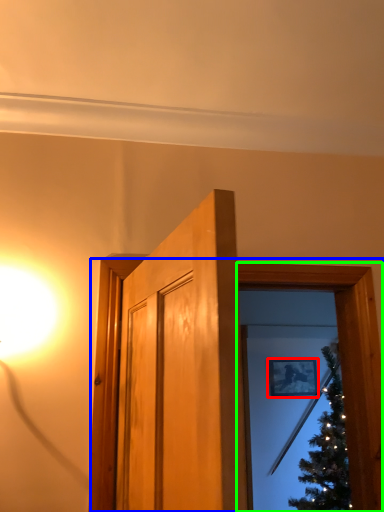
Question: Which object is positioned farthest from picture frame (highlighted by a red box)? Select from window frame (highlighted by a blue box) and window frame (highlighted by a green box).

Choices:
 (A) window frame
 (B) window frame

Answer: (B)